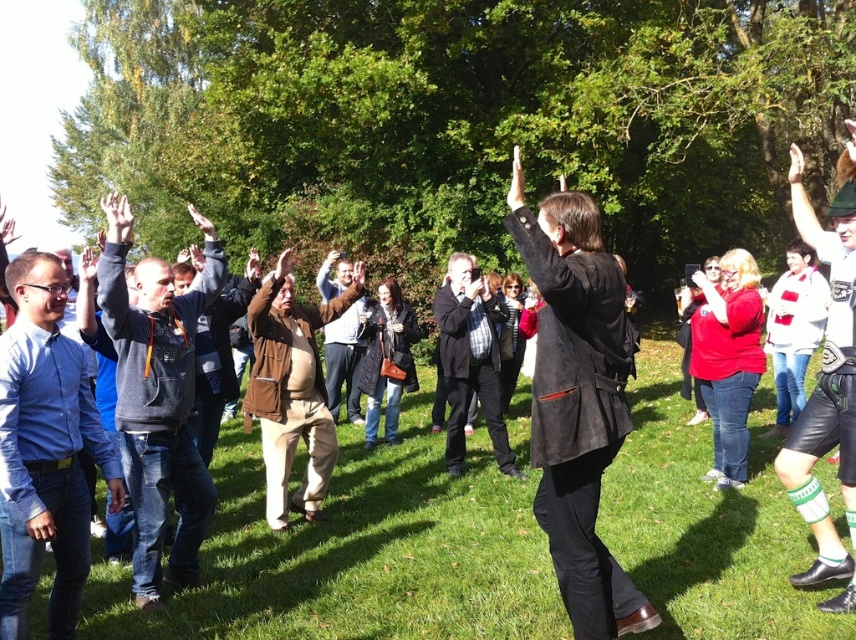
You are a photographer at this outdoor gathering. You notice the green leather shorts at center and the brown leather jacket at center. Which one is positioned higher from the ground?

The green leather shorts at center is above the brown leather jacket at center, so it is positioned higher from the ground.

You are at a community event and see two people wearing a blue shirt at left and a plaid fabric shirt at center. Which person is standing more to the left?

The blue shirt at left is more to the left than the plaid fabric shirt at center.

You are a photographer at the event and want to capture a photo that includes both the blue shirt at left and the plaid fabric shirt at center. Which shirt should you position lower in the frame to ensure both are visible?

The blue shirt at left is already positioned below the plaid fabric shirt at center, so to include both in the photo, you should position the blue shirt at left lower in the frame while keeping the plaid fabric shirt at center higher.